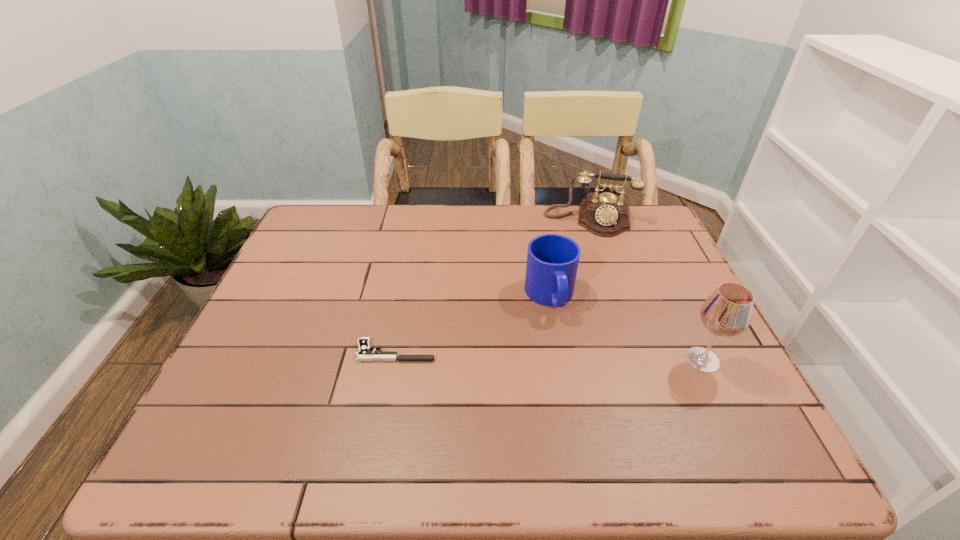
Where is `the shortest object`? Image resolution: width=960 pixels, height=540 pixels. the shortest object is located at coordinates (366, 353).

You are a GUI agent. You are given a task and a screenshot of the screen. Output one action in this format:
    pyautogui.click(x=<x>, y=<y>)
    Task: Click on the pistol
    The height and width of the screenshot is (540, 960).
    Given the screenshot: What is the action you would take?
    [366, 353]

Where is `the tallest object`? This screenshot has height=540, width=960. the tallest object is located at coordinates (727, 312).

You are a GUI agent. You are given a task and a screenshot of the screen. Output one action in this format:
    pyautogui.click(x=<x>, y=<y>)
    Task: Click on the third shortest object
    This screenshot has width=960, height=540.
    Given the screenshot: What is the action you would take?
    pyautogui.click(x=606, y=215)

This screenshot has height=540, width=960. Identify the location of the farthest object. point(606,215).

The image size is (960, 540). Identify the location of mug. (552, 260).

Where is `the third nearest object`? The height and width of the screenshot is (540, 960). the third nearest object is located at coordinates (552, 260).

This screenshot has width=960, height=540. I want to click on free spot located 0.300m on the front-facing side of the leftmost object, so click(564, 352).

This screenshot has height=540, width=960. I want to click on vacant space located 0.320m on the back of the tallest object, so click(x=655, y=260).

This screenshot has height=540, width=960. In order to click on free location located on the dial of the third shortest object in this screenshot , I will do click(581, 302).